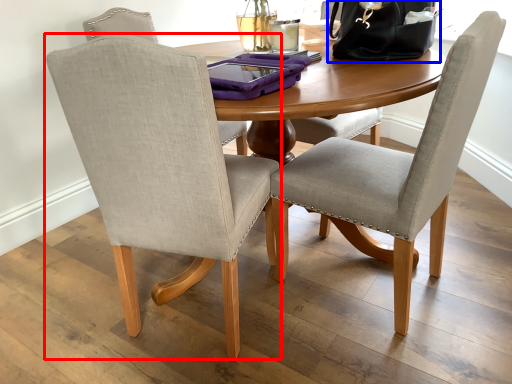
Question: Which object is closer to the camera taking this photo, chair (highlighted by a red box) or handbag (highlighted by a blue box)?

Choices:
 (A) chair
 (B) handbag

Answer: (A)